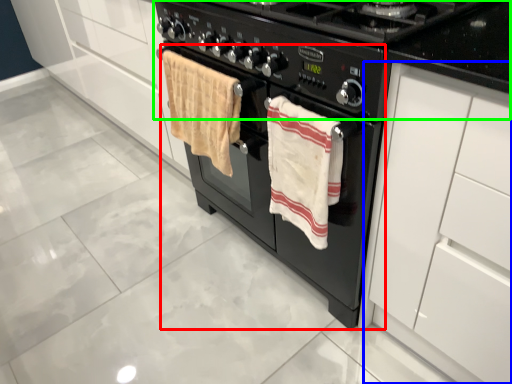
Question: Which is farther away from oven (highlighted by a red box)? cabinetry (highlighted by a blue box) or gas stove (highlighted by a green box)?

Choices:
 (A) cabinetry
 (B) gas stove

Answer: (A)